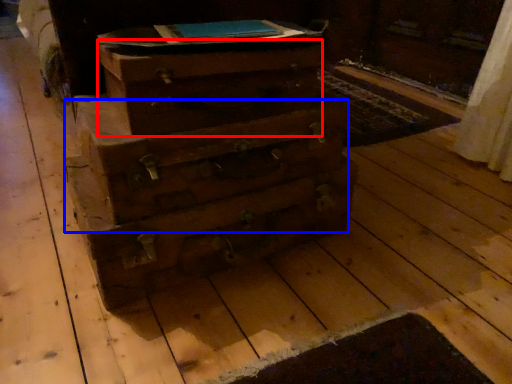
Question: Which object is closer to the camera taking this photo, drawer (highlighted by a red box) or drawer (highlighted by a blue box)?

Choices:
 (A) drawer
 (B) drawer

Answer: (A)